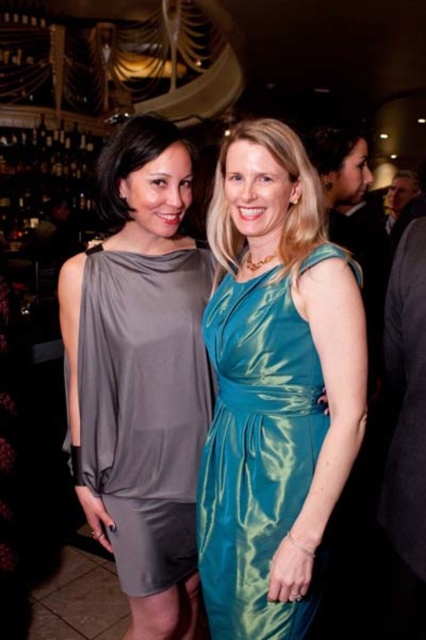
In the scene shown: You are a photographer at a formal event. You need to decide if the matte gray dress at center and the teal satin dress at center will fit side by side on a 1.2 meter wide backdrop. Can you confirm if both dresses will fit?

The matte gray dress at center might be wider than teal satin dress at center. Since the total width of both dresses combined could exceed 1.2 meters, it is uncertain if they will fit side by side on the backdrop.

You are a photographer at a formal event and need to adjust the lighting to ensure both the matte gray dress at center and the teal satin dress at center are well lit. Since the background is dimly lit, which dress should you focus on first to prevent overexposure?

The teal satin dress at center should be focused on first because it has a shiny, satin texture which can reflect more light and may overexposure faster than the matte gray dress at center.